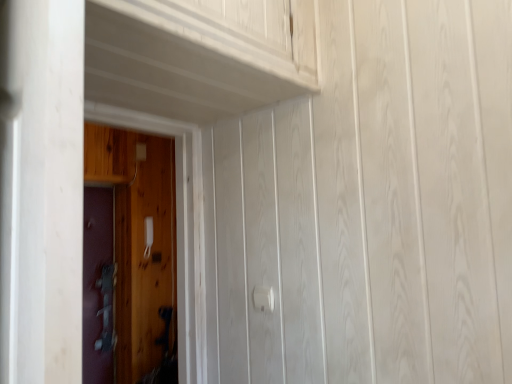
Question: Is metallic gray door at left, the 2th door positioned from the right, to the left or to the right of wooden door at left, the 1th door viewed from the right, in the image?

Choices:
 (A) right
 (B) left

Answer: (B)

Question: Considering the positions of metallic gray door at left, the first door viewed from the left, and wooden door at left, the 2th door in the left-to-right sequence, in the image, is metallic gray door at left, the first door viewed from the left, wider or thinner than wooden door at left, the 2th door in the left-to-right sequence,?

Choices:
 (A) wide
 (B) thin

Answer: (B)

Question: Estimate the real-world distances between objects in this image. Which object is farther from the metallic gray door at left, the first door viewed from the left?

Choices:
 (A) white plastic door handle at center
 (B) wooden door at left, the 1th door viewed from the right

Answer: (A)

Question: Considering the real-world distances, which object is farthest from the metallic gray door at left, the first door viewed from the left?

Choices:
 (A) white plastic door handle at center
 (B) wooden door at left, marked as the second door in a back-to-front arrangement

Answer: (A)